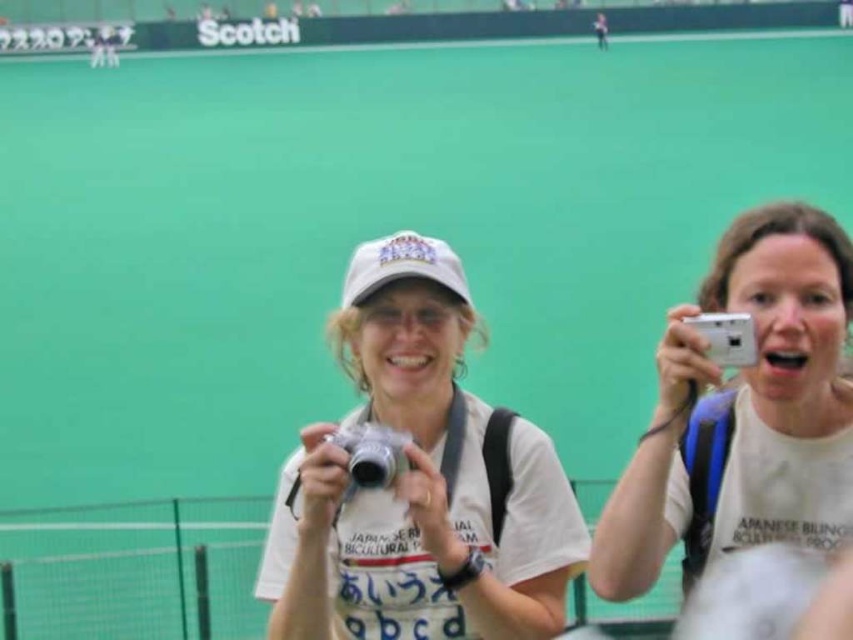
Question: Estimate the real-world distances between objects in this image. Which object is farther from the white matte cap at center?

Choices:
 (A) white plastic camera at right
 (B) white plastic camera at upper right

Answer: (B)

Question: Is white plastic camera at right smaller than white plastic camera at upper right?

Choices:
 (A) yes
 (B) no

Answer: (B)

Question: Is the position of white matte cap at center less distant than that of silver metallic camera at center?

Choices:
 (A) no
 (B) yes

Answer: (B)

Question: Is silver metallic camera at center bigger than white plastic camera at upper right?

Choices:
 (A) yes
 (B) no

Answer: (A)

Question: Which of the following is the closest to the observer?

Choices:
 (A) silver metallic camera at center
 (B) white plastic camera at right
 (C) white plastic camera at upper right
 (D) white matte cap at center

Answer: (B)

Question: Which object is farther from the camera taking this photo?

Choices:
 (A) white plastic camera at upper right
 (B) white plastic camera at right
 (C) silver metallic camera at center
 (D) white matte cap at center

Answer: (C)